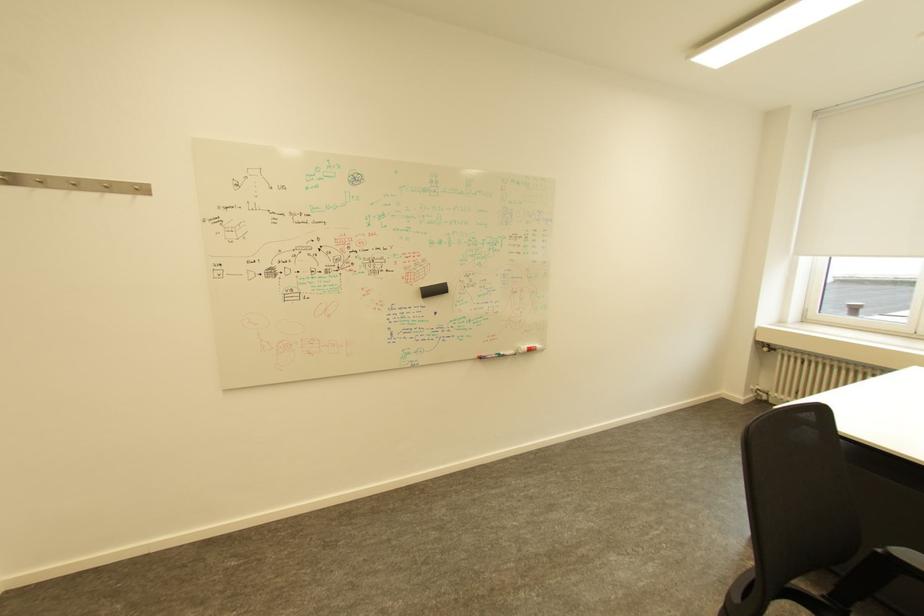
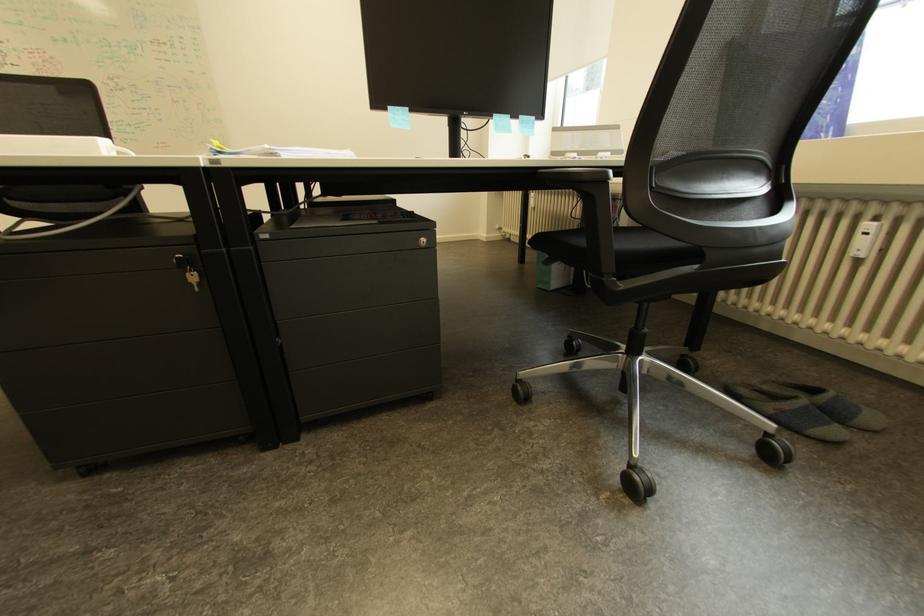
Question: The images are taken continuously from a first-person perspective. In which direction are you moving?

Choices:
 (A) Left
 (B) Right
 (C) Forward
 (D) Backward

Answer: (B)